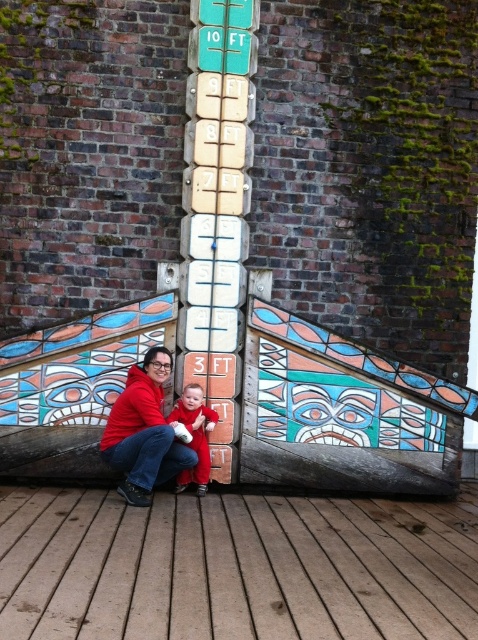
Question: Does red hoodie at lower center appear on the right side of matte red onesie at center?

Choices:
 (A) no
 (B) yes

Answer: (A)

Question: Does red hoodie at lower center appear under matte red onesie at center?

Choices:
 (A) no
 (B) yes

Answer: (A)

Question: Among these objects, which one is farthest from the camera?

Choices:
 (A) matte red onesie at center
 (B) red hoodie at lower center

Answer: (A)

Question: Which point is farther from the camera taking this photo?

Choices:
 (A) (148, 429)
 (B) (206, 448)

Answer: (B)

Question: Which of the following is the closest to the observer?

Choices:
 (A) (195, 401)
 (B) (162, 435)

Answer: (B)

Question: Can you confirm if red hoodie at lower center is smaller than matte red onesie at center?

Choices:
 (A) yes
 (B) no

Answer: (B)